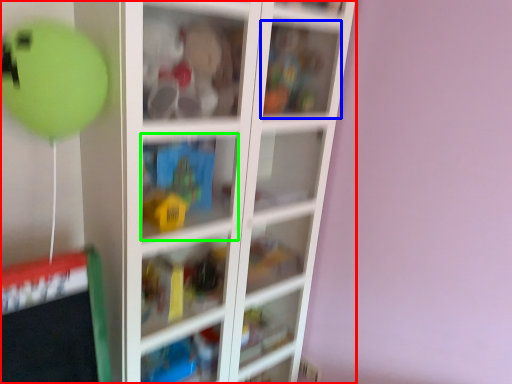
Question: Which object is the farthest from shelf (highlighted by a red box)? Choose among these: cabinet (highlighted by a blue box) or cabinet (highlighted by a green box).

Choices:
 (A) cabinet
 (B) cabinet

Answer: (A)